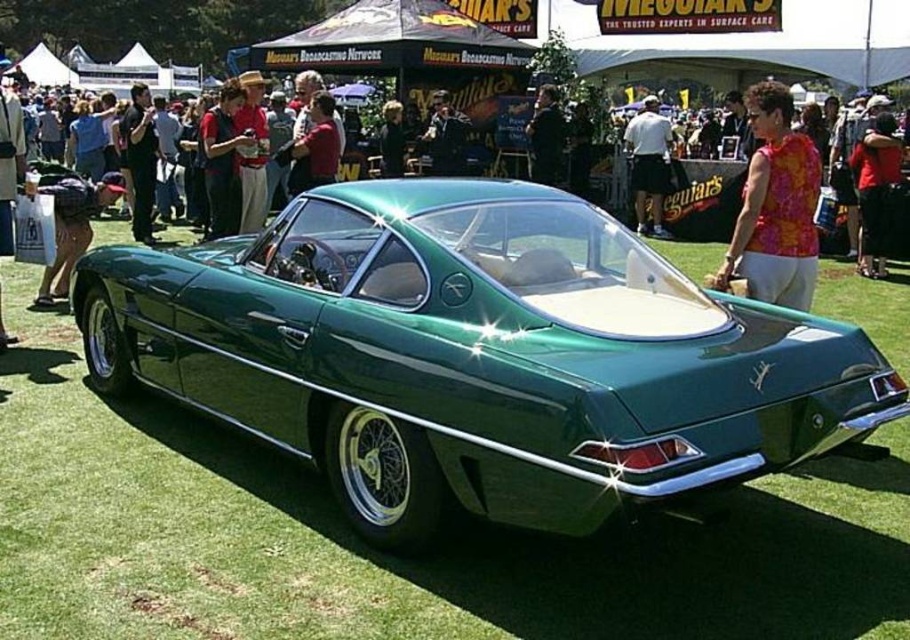
Question: Is the position of green glossy car at center more distant than that of floral fabric blouse at center?

Choices:
 (A) yes
 (B) no

Answer: (B)

Question: Which point is closer to the camera taking this photo?

Choices:
 (A) (752, 365)
 (B) (53, 202)
 (C) (659, 200)

Answer: (A)

Question: Observing the image, what is the correct spatial positioning of matte black jacket at lower left in reference to dark blue suit at center?

Choices:
 (A) right
 (B) left

Answer: (B)

Question: Is red fabric shirt at upper right thinner than matte black jacket at lower left?

Choices:
 (A) no
 (B) yes

Answer: (B)

Question: Among these objects, which one is nearest to the camera?

Choices:
 (A) floral fabric blouse at center
 (B) red fabric shirt at upper right
 (C) white cotton shirt at center
 (D) dark blue shirt at center

Answer: (A)

Question: Which point is farther to the camera?

Choices:
 (A) red fabric shirt at upper right
 (B) floral fabric blouse at center
 (C) dark blue suit at center

Answer: (C)